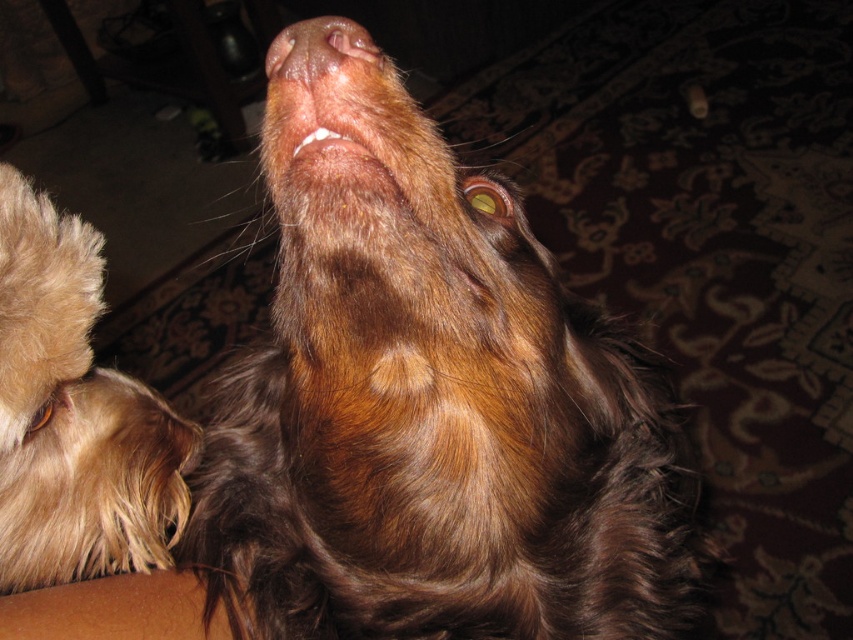
You are a photographer trying to capture a close shot of the pink smooth nose at upper center without the fuzzy brown fur at lower left blocking it. Based on their positions, can you adjust your camera angle to achieve this?

The fuzzy brown fur at lower left is positioned under the pink smooth nose at upper center. By tilting the camera upwards or moving it closer to the nose while angling downward, you can avoid the brown fur blocking the view of the pink smooth nose at upper center.

You are a photographer trying to capture a close shot of the pink smooth nose at upper center without the fuzzy brown fur at lower left blocking the view. Can you adjust your camera angle to achieve this?

The fuzzy brown fur at lower left is much taller than the pink smooth nose at upper center, so adjusting the camera angle downward might help avoid blocking the view of the pink smooth nose at upper center.